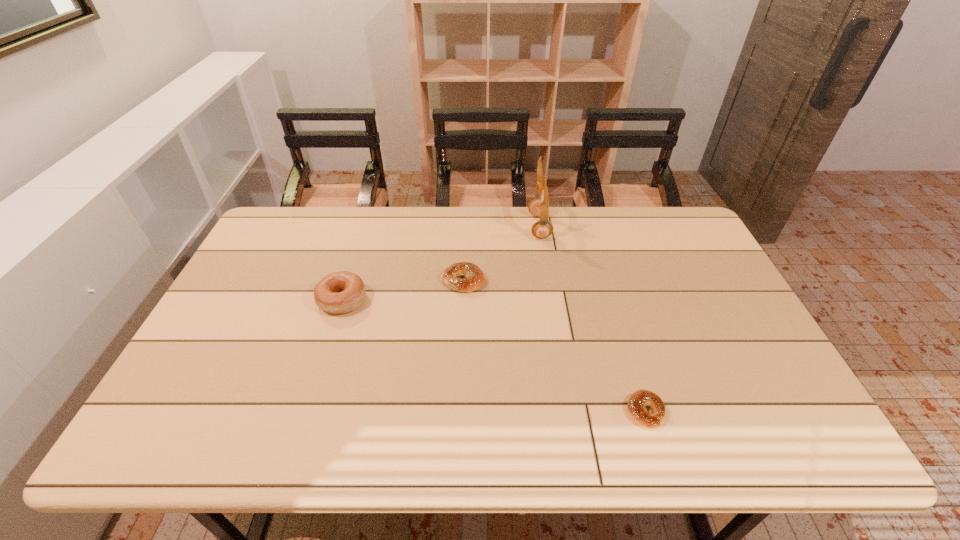
This screenshot has width=960, height=540. What are the coordinates of `the tallest object` in the screenshot? It's located at (539, 207).

Locate an element on the screen. This screenshot has width=960, height=540. the second object from right to left is located at coordinates click(539, 207).

Identify the location of the third shortest object. (340, 292).

You are a GUI agent. You are given a task and a screenshot of the screen. Output one action in this format:
    pyautogui.click(x=<x>, y=<y>)
    Task: Click on the leftmost bagel
    
    Given the screenshot: What is the action you would take?
    pyautogui.click(x=340, y=292)

Where is `the second bagel from right to left`? the second bagel from right to left is located at coordinates (474, 278).

Where is `the second shortest object`? The image size is (960, 540). the second shortest object is located at coordinates (474, 278).

The width and height of the screenshot is (960, 540). What are the coordinates of `the rightmost object` in the screenshot? It's located at (639, 399).

Image resolution: width=960 pixels, height=540 pixels. In order to click on the shortest object in this screenshot , I will do `click(639, 399)`.

Where is `vacant area situated 0.290m on the front-facing side of the farthest object`? Image resolution: width=960 pixels, height=540 pixels. vacant area situated 0.290m on the front-facing side of the farthest object is located at coordinates (446, 227).

Find the location of a particular element. The width and height of the screenshot is (960, 540). vacant space situated 0.200m on the front-facing side of the farthest object is located at coordinates (471, 227).